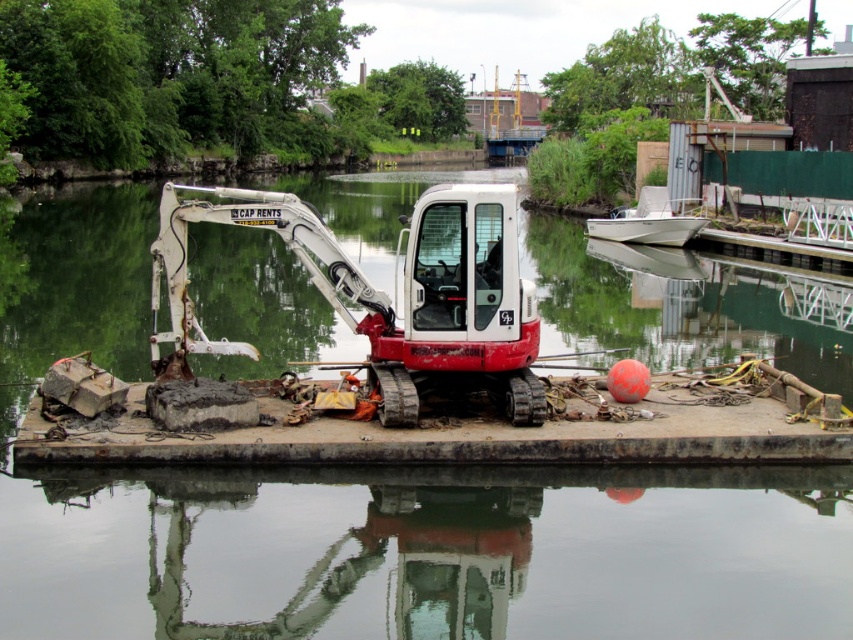
Question: Does rusty concrete dock at center appear under matte white/red excavator at center?

Choices:
 (A) no
 (B) yes

Answer: (B)

Question: Is green reflective water at center smaller than white matte boat at upper right?

Choices:
 (A) yes
 (B) no

Answer: (B)

Question: Which of these objects is positioned closest to the rusty concrete dock at center?

Choices:
 (A) matte white/red excavator at center
 (B) green reflective water at center
 (C) white matte boat at upper right

Answer: (A)

Question: Which point is farther to the camera?

Choices:
 (A) (230, 340)
 (B) (606, 445)
 (C) (189, 524)
 (D) (660, 198)

Answer: (D)

Question: Estimate the real-world distances between objects in this image. Which object is farther from the rusty concrete dock at center?

Choices:
 (A) matte white/red excavator at center
 (B) white matte boat at upper right
 (C) green reflective water at center

Answer: (B)

Question: Does matte white/red excavator at center appear on the right side of white matte boat at upper right?

Choices:
 (A) no
 (B) yes

Answer: (A)